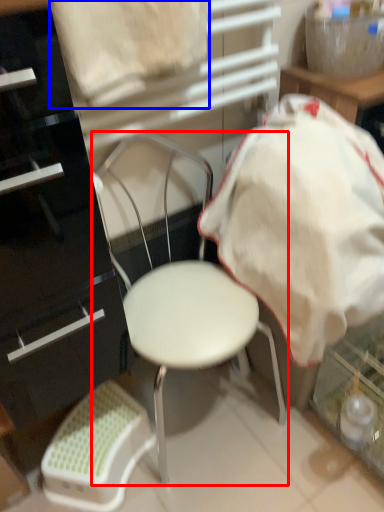
Question: Which object is closer to the camera taking this photo, chair (highlighted by a red box) or sheet (highlighted by a blue box)?

Choices:
 (A) chair
 (B) sheet

Answer: (B)